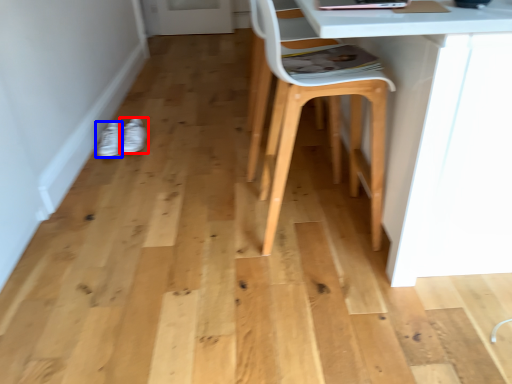
Question: Among these objects, which one is farthest to the camera, footwear (highlighted by a red box) or footwear (highlighted by a blue box)?

Choices:
 (A) footwear
 (B) footwear

Answer: (A)